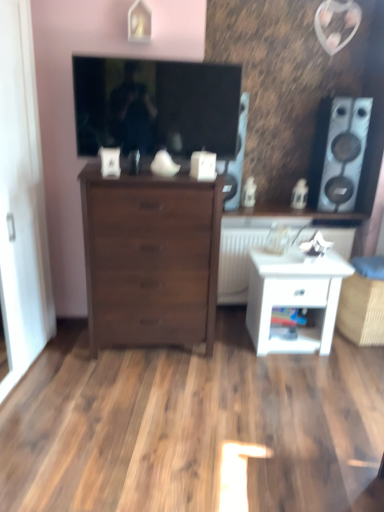
Where is `vacant space to the right of dark wood chest of drawers at center`? The image size is (384, 512). vacant space to the right of dark wood chest of drawers at center is located at coordinates (238, 356).